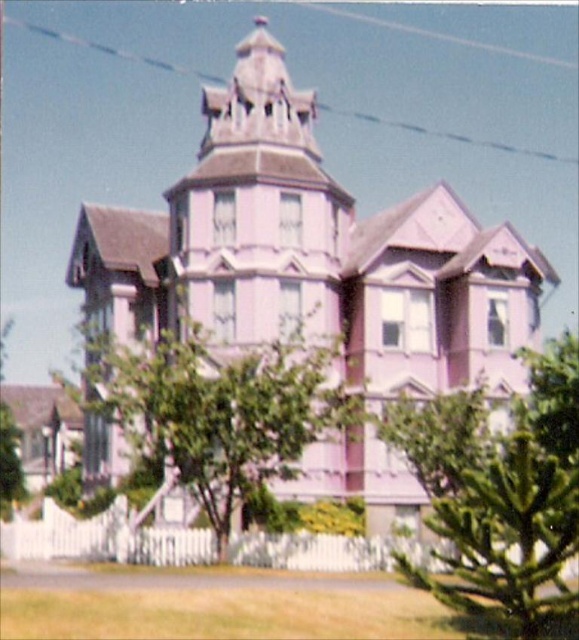
You are standing in the yard of the Victorian house and want to plant a new tree. The existing trees are the green leafy tree at center and the green leafy tree at lower left. Which tree is closer to you?

The green leafy tree at lower left is closer to you because the green leafy tree at center is positioned over it, indicating it is behind and farther away.

You are standing in front of the Victorian house and notice two trees in the yard. Which tree, the green textured tree at lower right or the green leafy tree at lower left, is closer to you?

The green textured tree at lower right is closer to you because it is positioned in front of the green leafy tree at lower left.